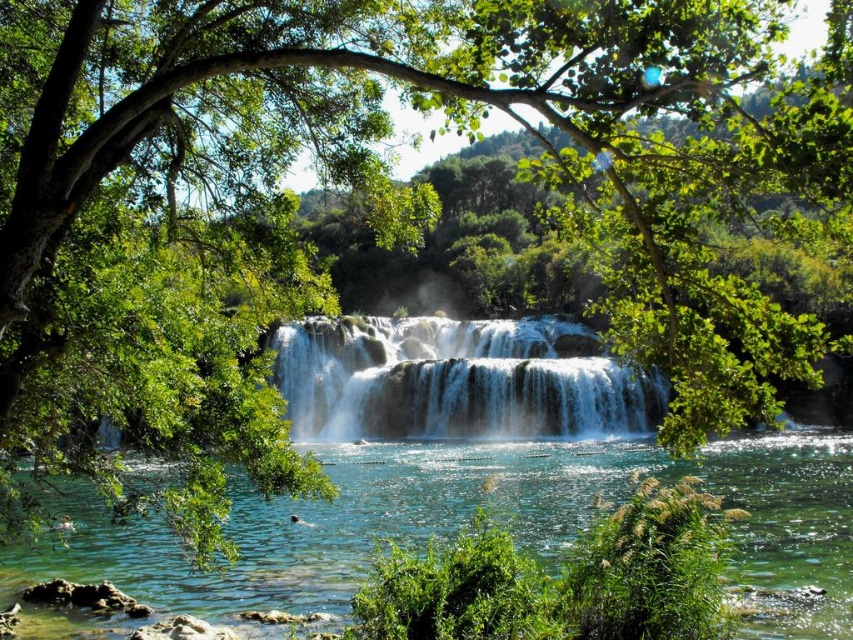
The width and height of the screenshot is (853, 640). What do you see at coordinates (471, 516) in the screenshot?
I see `clear blue water at center` at bounding box center [471, 516].

You are a GUI agent. You are given a task and a screenshot of the screen. Output one action in this format:
    pyautogui.click(x=<x>, y=<y>)
    Task: Click on the clear blue water at center
    The height and width of the screenshot is (640, 853).
    Given the screenshot: What is the action you would take?
    pyautogui.click(x=471, y=516)